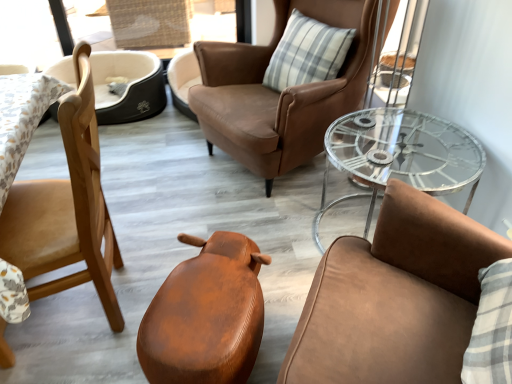
Question: From a real-world perspective, is leather-like brown stool at center, the third chair in the left-to-right sequence, beneath brown leather chair at center, arranged as the second chair when viewed from the right?

Choices:
 (A) no
 (B) yes

Answer: (B)

Question: Could you tell me if leather-like brown stool at center, acting as the third chair starting from the right, is turned towards brown leather chair at center, which ranks as the 4th chair in left-to-right order?

Choices:
 (A) yes
 (B) no

Answer: (A)

Question: Is leather-like brown stool at center, acting as the third chair starting from the right, smaller than brown leather chair at center, arranged as the second chair when viewed from the right?

Choices:
 (A) yes
 (B) no

Answer: (A)

Question: Can brown leather chair at center, which ranks as the 4th chair in left-to-right order, be found inside leather-like brown stool at center, the third chair in the left-to-right sequence?

Choices:
 (A) yes
 (B) no

Answer: (B)

Question: Is leather-like brown stool at center, acting as the third chair starting from the right, to the left of brown leather chair at center, which ranks as the 4th chair in left-to-right order, from the viewer's perspective?

Choices:
 (A) no
 (B) yes

Answer: (B)

Question: Can you confirm if leather-like brown stool at center, acting as the third chair starting from the right, is wider than brown leather chair at center, which ranks as the 4th chair in left-to-right order?

Choices:
 (A) yes
 (B) no

Answer: (B)

Question: From the image's perspective, is leather chair at center, acting as the 5th chair starting from the left, on plaid fabric pillow at center?

Choices:
 (A) yes
 (B) no

Answer: (B)

Question: Does leather chair at center, acting as the 5th chair starting from the left, appear on the right side of plaid fabric pillow at center?

Choices:
 (A) no
 (B) yes

Answer: (B)

Question: Is leather chair at center, acting as the 5th chair starting from the left, wider than plaid fabric pillow at center?

Choices:
 (A) no
 (B) yes

Answer: (B)

Question: Considering the relative positions of leather chair at center, acting as the 5th chair starting from the left, and plaid fabric pillow at center in the image provided, is leather chair at center, acting as the 5th chair starting from the left, in front of plaid fabric pillow at center?

Choices:
 (A) no
 (B) yes

Answer: (B)

Question: Is plaid fabric pillow at center at the back of leather chair at center, arranged as the first chair when viewed from the right?

Choices:
 (A) no
 (B) yes

Answer: (A)

Question: Considering the relative sizes of leather chair at center, arranged as the first chair when viewed from the right, and plaid fabric pillow at center in the image provided, is leather chair at center, arranged as the first chair when viewed from the right, thinner than plaid fabric pillow at center?

Choices:
 (A) no
 (B) yes

Answer: (A)

Question: Does leather chair at center, arranged as the first chair when viewed from the right, have a smaller size compared to light brown wood chair at left, which ranks as the fourth chair in right-to-left order?

Choices:
 (A) no
 (B) yes

Answer: (A)